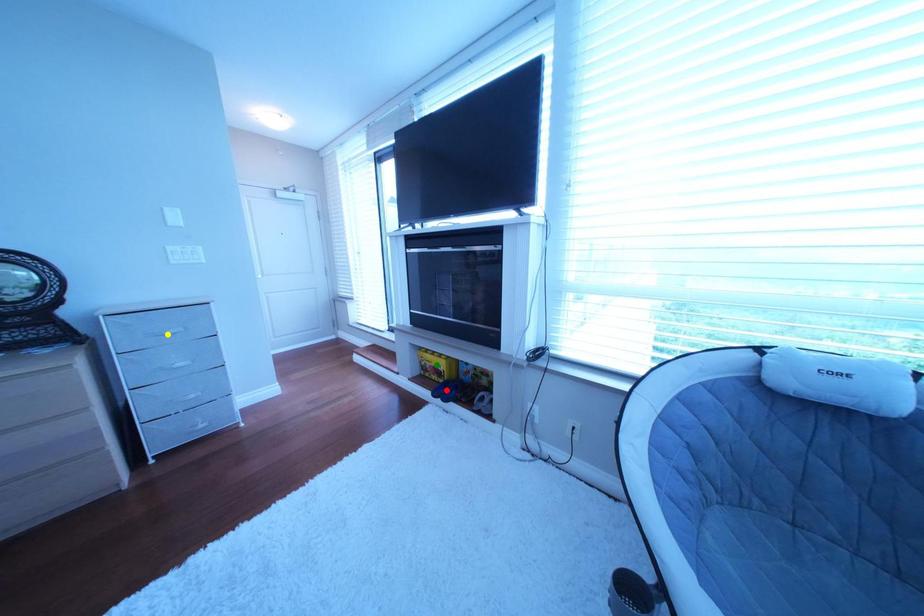
Order these from nearest to farthest:
yellow point
green point
red point

green point → red point → yellow point